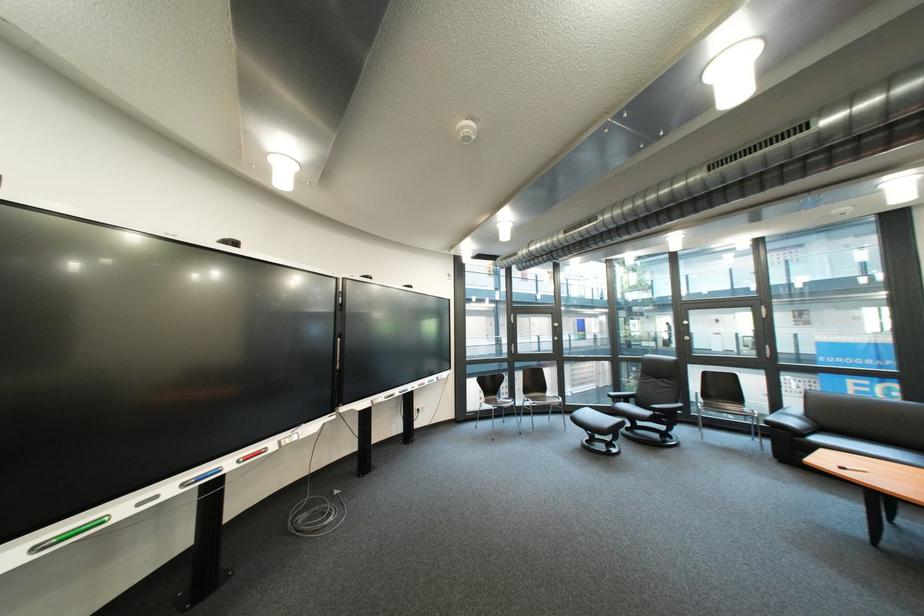
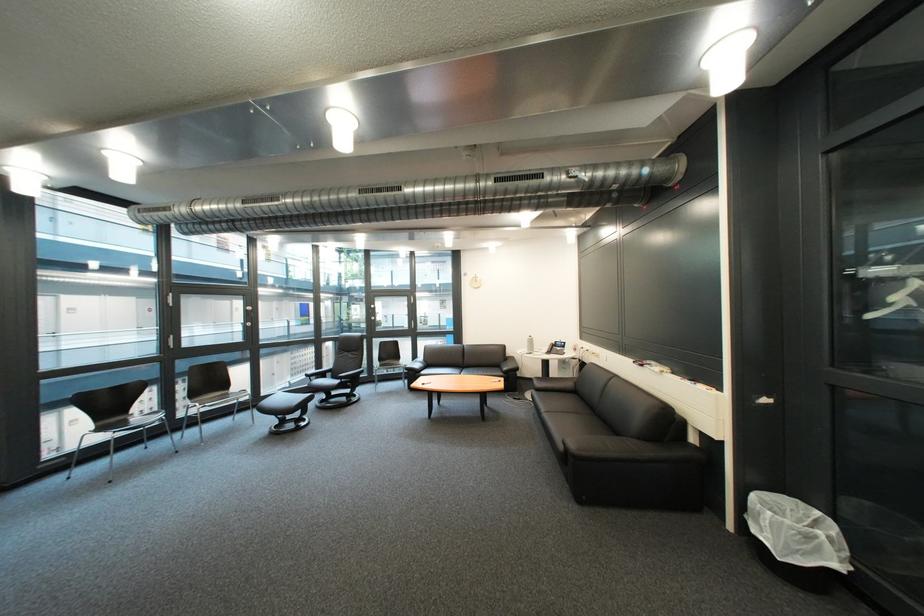
Question: The images are taken continuously from a first-person perspective. In which direction is your viewpoint rotating?

Choices:
 (A) Left
 (B) Right
 (C) Up
 (D) Down

Answer: (B)